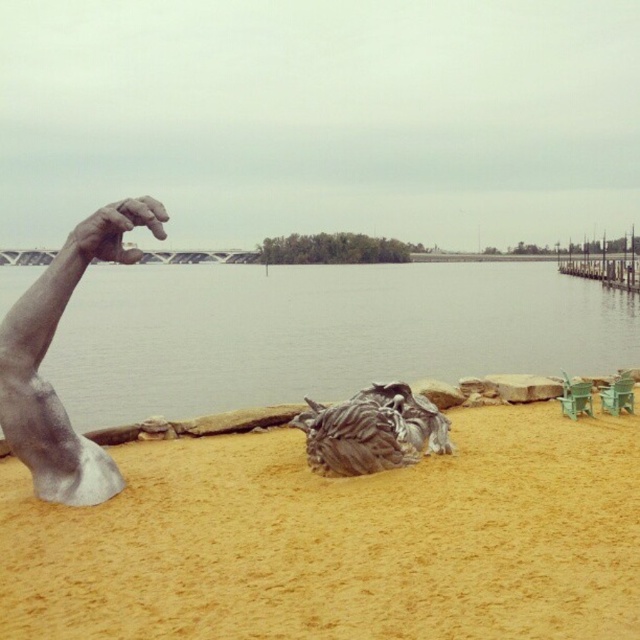
Question: Which point appears closest to the camera in this image?

Choices:
 (A) (608, 340)
 (B) (404, 460)
 (C) (618, 282)

Answer: (B)

Question: Is rough textured rock at center closer to camera compared to wooden dock at right?

Choices:
 (A) no
 (B) yes

Answer: (B)

Question: Can you confirm if yellow sand at lower center is positioned above wooden dock at right?

Choices:
 (A) no
 (B) yes

Answer: (A)

Question: Is yellow sand at lower center closer to camera compared to rough textured rock at center?

Choices:
 (A) yes
 (B) no

Answer: (A)

Question: Which object appears closest to the camera in this image?

Choices:
 (A) silver metallic hand at upper left
 (B) wooden dock at right
 (C) yellow sand at lower center
 (D) grayish-blue water at center

Answer: (C)

Question: Which is farther from the silver metallic hand at upper left?

Choices:
 (A) grayish-blue water at center
 (B) wooden dock at right
 (C) silver metallic arm at left

Answer: (B)